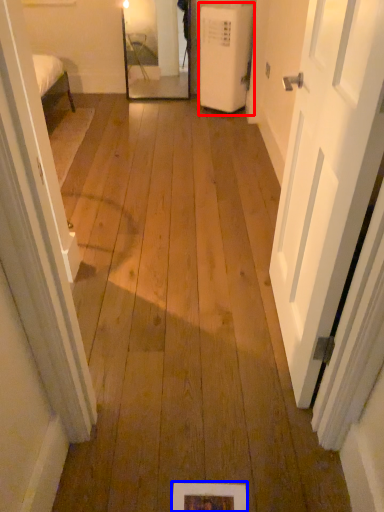
Question: Among these objects, which one is nearest to the camera, air conditioner (highlighted by a red box) or picture frame (highlighted by a blue box)?

Choices:
 (A) air conditioner
 (B) picture frame

Answer: (B)